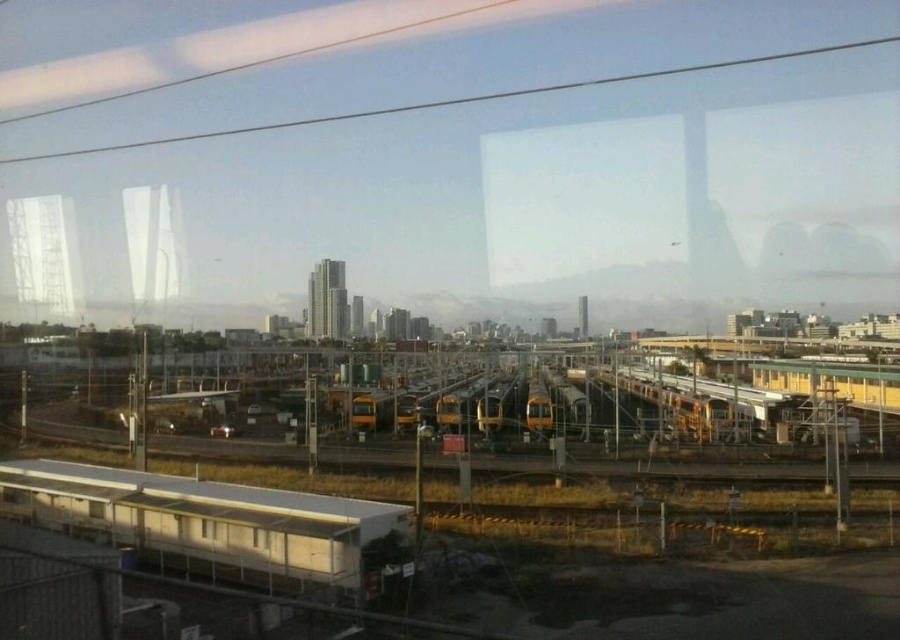
Question: Does transparent glass window at lower left have a smaller size compared to transparent glass window at lower center?

Choices:
 (A) yes
 (B) no

Answer: (B)

Question: Considering the real-world distances, which object is farthest from the white matte platform at lower left?

Choices:
 (A) transparent glass window at lower left
 (B) transparent glass window at lower center

Answer: (B)

Question: Which of the following is the closest to the observer?

Choices:
 (A) transparent glass window at lower center
 (B) transparent glass window at lower left

Answer: (A)

Question: Is white matte platform at lower left further to the viewer compared to transparent glass window at lower left?

Choices:
 (A) yes
 (B) no

Answer: (B)

Question: Which object appears closest to the camera in this image?

Choices:
 (A) transparent glass window at lower center
 (B) transparent glass window at lower left
 (C) white matte platform at lower left

Answer: (C)

Question: Is transparent glass window at lower left to the right of transparent glass window at lower center from the viewer's perspective?

Choices:
 (A) no
 (B) yes

Answer: (A)